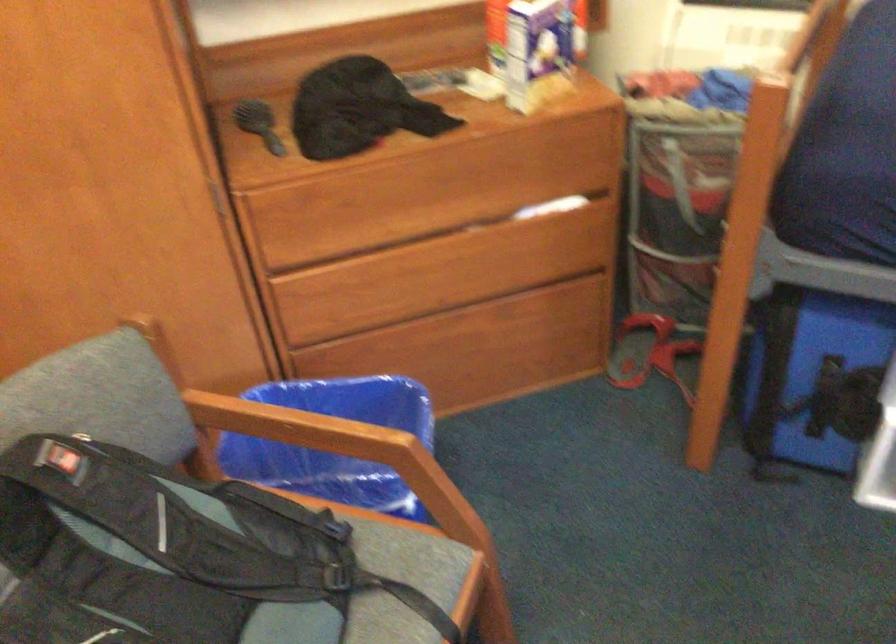
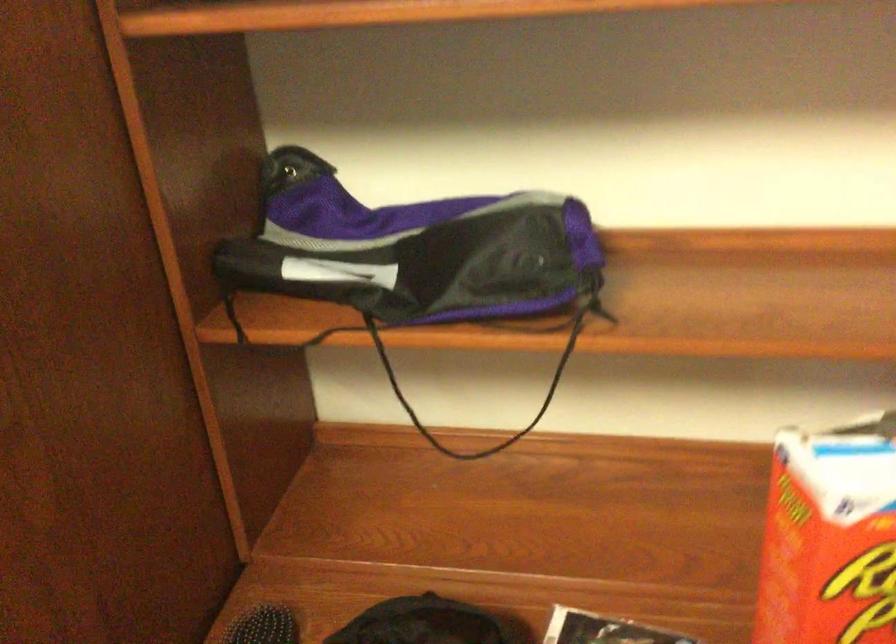
Question: The images are taken continuously from a first-person perspective. In which direction are you moving?

Choices:
 (A) Left
 (B) Right
 (C) Forward
 (D) Backward

Answer: (C)